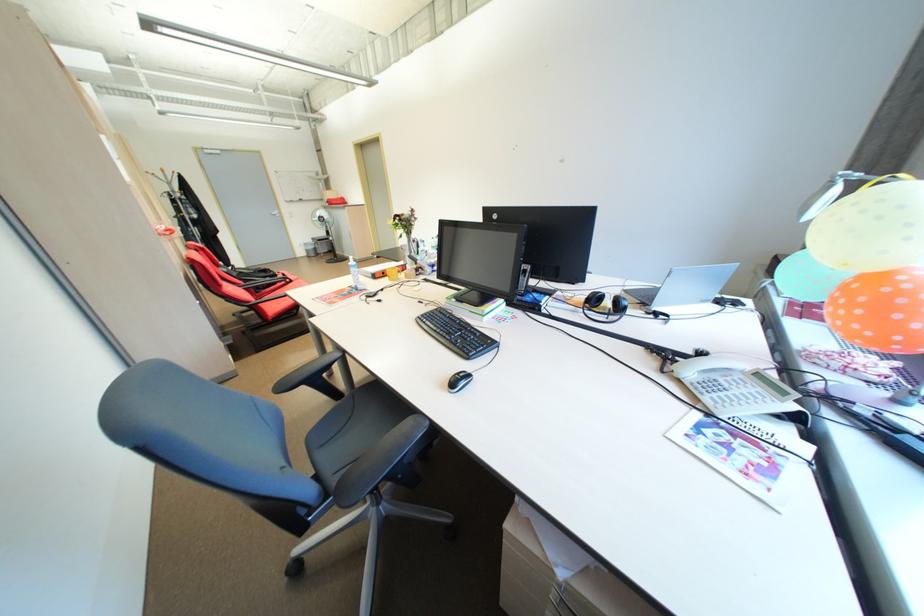
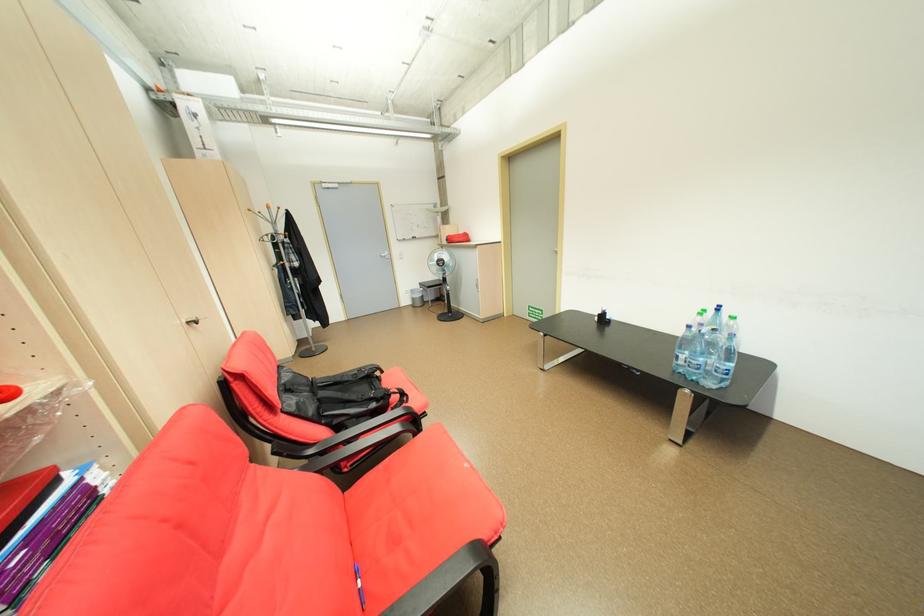
Locate, in the second image, the point that corresponds to (310,253) in the first image.

(415, 302)